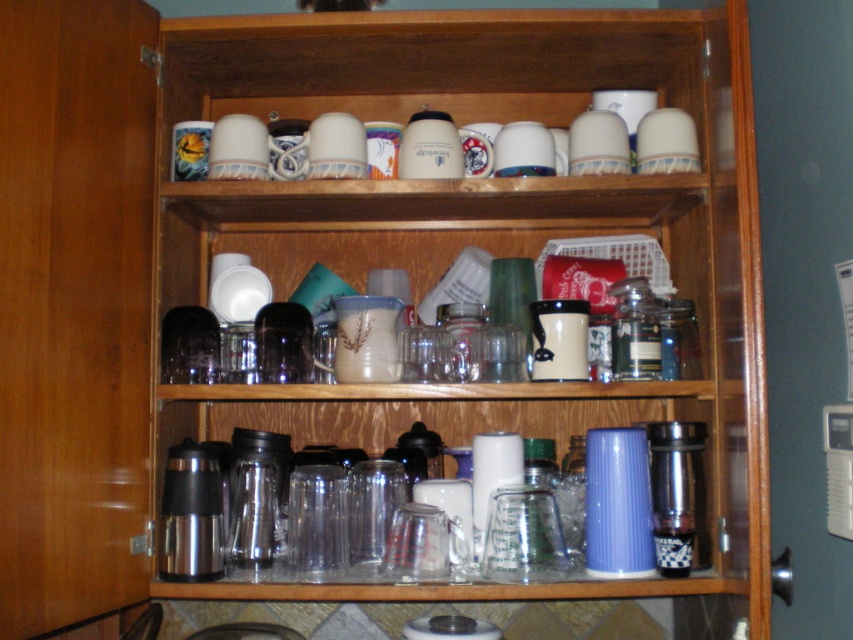
Question: Among these objects, which one is farthest from the camera?

Choices:
 (A) metallic thermos at lower center
 (B) translucent glass cups at upper center

Answer: (A)

Question: Can you confirm if translucent glass cups at upper center is bigger than metallic thermos at lower center?

Choices:
 (A) no
 (B) yes

Answer: (B)

Question: In this image, where is translucent glass cups at upper center located relative to metallic thermos at lower center?

Choices:
 (A) right
 (B) left

Answer: (A)

Question: Does translucent glass cups at upper center have a greater width compared to metallic thermos at lower center?

Choices:
 (A) no
 (B) yes

Answer: (B)

Question: Which object appears farthest from the camera in this image?

Choices:
 (A) translucent glass cups at upper center
 (B) metallic thermos at lower center

Answer: (B)